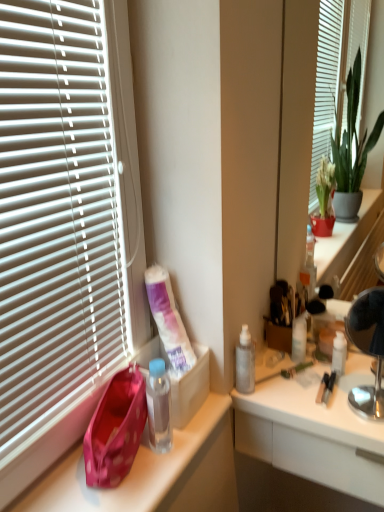
The image size is (384, 512). In order to click on vacant space that is in between metallic silver lamp at right and transparent plastic bottle at center-right in this screenshot , I will do `click(299, 396)`.